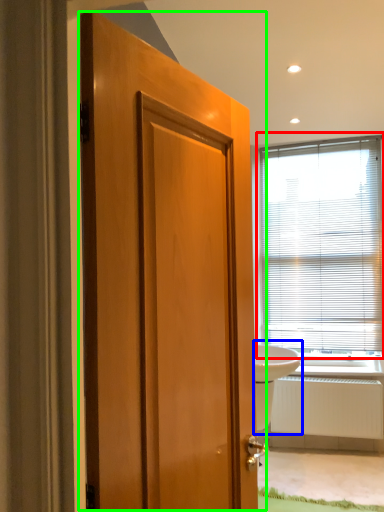
Question: Estimate the real-world distances between objects in this image. Which object is farther from window blind (highlighted by a red box), sink (highlighted by a blue box) or door (highlighted by a green box)?

Choices:
 (A) sink
 (B) door

Answer: (B)